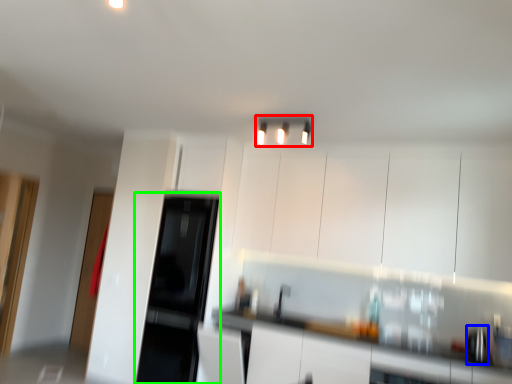
Question: Based on their relative distances, which object is farther from light fixture (highlighted by a red box)? Choose from appliance (highlighted by a blue box) and appliance (highlighted by a green box).

Choices:
 (A) appliance
 (B) appliance

Answer: (B)